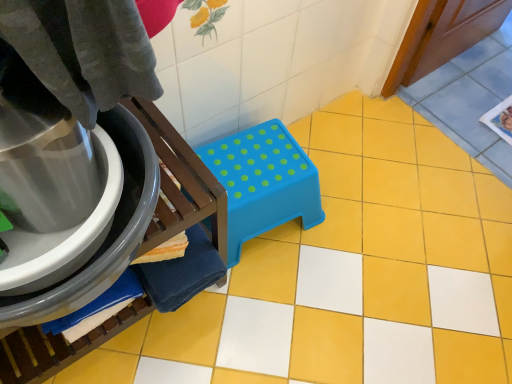
This screenshot has height=384, width=512. What are the coordinates of `vacant area that is situated to the right of blue plastic step stool at center` in the screenshot? It's located at (354, 228).